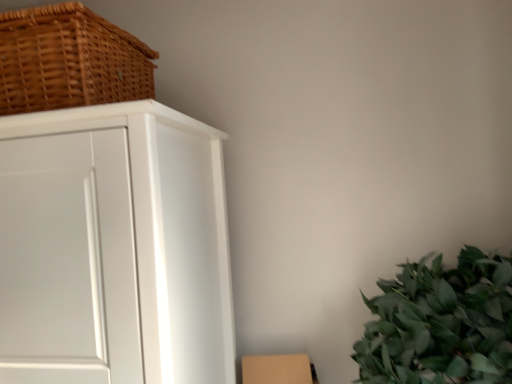
Question: Is woven brown basket at upper left to the left or to the right of white matte cabinet at left in the image?

Choices:
 (A) left
 (B) right

Answer: (A)

Question: Does point (20, 26) appear closer or farther from the camera than point (72, 152)?

Choices:
 (A) closer
 (B) farther

Answer: (B)

Question: Which object is the farthest from the brown cardboard box at lower right?

Choices:
 (A) white matte cabinet at left
 (B) woven brown basket at upper left

Answer: (B)

Question: Which of these objects is positioned closest to the woven brown basket at upper left?

Choices:
 (A) white matte cabinet at left
 (B) brown cardboard box at lower right

Answer: (A)